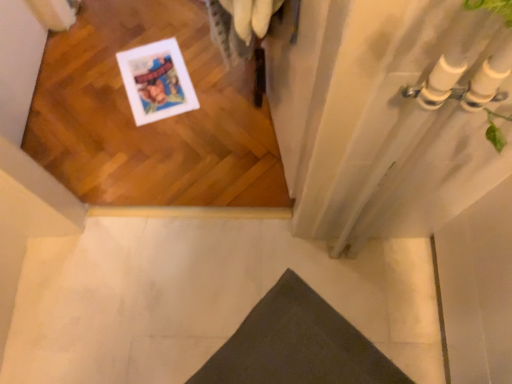
Question: Can you confirm if white tile floor at lower left is thinner than dark gray fabric doormat at lower center?

Choices:
 (A) no
 (B) yes

Answer: (A)

Question: Is white tile floor at lower left to the right of dark gray fabric doormat at lower center from the viewer's perspective?

Choices:
 (A) no
 (B) yes

Answer: (A)

Question: Considering the relative sizes of white tile floor at lower left and dark gray fabric doormat at lower center in the image provided, is white tile floor at lower left shorter than dark gray fabric doormat at lower center?

Choices:
 (A) yes
 (B) no

Answer: (B)

Question: Is the depth of white tile floor at lower left less than that of dark gray fabric doormat at lower center?

Choices:
 (A) no
 (B) yes

Answer: (A)

Question: Is white tile floor at lower left facing away from dark gray fabric doormat at lower center?

Choices:
 (A) no
 (B) yes

Answer: (A)

Question: Is white tile floor at lower left taller than dark gray fabric doormat at lower center?

Choices:
 (A) no
 (B) yes

Answer: (B)

Question: From a real-world perspective, does dark gray fabric doormat at lower center stand above white tile floor at lower left?

Choices:
 (A) no
 (B) yes

Answer: (B)

Question: Is dark gray fabric doormat at lower center positioned in front of white tile floor at lower left?

Choices:
 (A) no
 (B) yes

Answer: (B)

Question: Does dark gray fabric doormat at lower center come behind white tile floor at lower left?

Choices:
 (A) yes
 (B) no

Answer: (B)

Question: From a real-world perspective, does dark gray fabric doormat at lower center sit lower than white tile floor at lower left?

Choices:
 (A) yes
 (B) no

Answer: (B)

Question: Does dark gray fabric doormat at lower center have a greater height compared to white tile floor at lower left?

Choices:
 (A) no
 (B) yes

Answer: (A)

Question: Considering the relative positions of dark gray fabric doormat at lower center and white tile floor at lower left in the image provided, is dark gray fabric doormat at lower center to the left of white tile floor at lower left from the viewer's perspective?

Choices:
 (A) yes
 (B) no

Answer: (B)

Question: Considering the positions of white tile floor at lower left and dark gray fabric doormat at lower center in the image, is white tile floor at lower left wider or thinner than dark gray fabric doormat at lower center?

Choices:
 (A) wide
 (B) thin

Answer: (A)